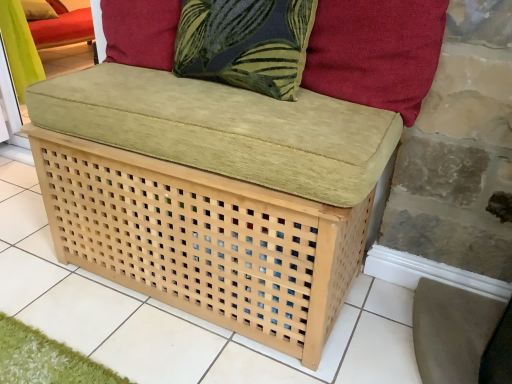
Image resolution: width=512 pixels, height=384 pixels. What do you see at coordinates (245, 43) in the screenshot?
I see `dark blue fabric pillow at upper center` at bounding box center [245, 43].

Image resolution: width=512 pixels, height=384 pixels. Identify the location of velvet cushion at upper left, the 2th pillow positioned from the front. (38, 10).

At what (x,y) coordinates should I click in order to perform the action: click on suede-like red cushion at upper right, the 2th pillow viewed from the left. Please return your answer as a coordinate pair (x, y). Image resolution: width=512 pixels, height=384 pixels. Looking at the image, I should click on (376, 52).

Who is taller, dark blue fabric pillow at upper center or velvet cushion at upper left, acting as the 1th pillow starting from the top?

Standing taller between the two is dark blue fabric pillow at upper center.

Based on the photo, in terms of width, does dark blue fabric pillow at upper center look wider or thinner when compared to velvet cushion at upper left, the second pillow when ordered from bottom to top?

Clearly, dark blue fabric pillow at upper center has less width compared to velvet cushion at upper left, the second pillow when ordered from bottom to top.

Is dark blue fabric pillow at upper center in contact with velvet cushion at upper left, the 2th pillow positioned from the front?

No, dark blue fabric pillow at upper center is not touching velvet cushion at upper left, the 2th pillow positioned from the front.

Is dark blue fabric pillow at upper center smaller than velvet cushion at upper left, which appears as the second pillow when viewed from the right?

Incorrect, dark blue fabric pillow at upper center is not smaller in size than velvet cushion at upper left, which appears as the second pillow when viewed from the right.

Considering the sizes of objects dark blue fabric pillow at upper center and suede-like red cushion at upper right, the 1th pillow viewed from the right, in the image provided, who is smaller, dark blue fabric pillow at upper center or suede-like red cushion at upper right, the 1th pillow viewed from the right,?

suede-like red cushion at upper right, the 1th pillow viewed from the right.

Could you measure the distance between dark blue fabric pillow at upper center and suede-like red cushion at upper right, marked as the 2th pillow in a top-to-bottom arrangement?

dark blue fabric pillow at upper center and suede-like red cushion at upper right, marked as the 2th pillow in a top-to-bottom arrangement, are 7.28 inches apart from each other.

From a real-world perspective, is dark blue fabric pillow at upper center beneath suede-like red cushion at upper right, which appears as the first pillow when ordered from the bottom?

Yes, from a real-world perspective, dark blue fabric pillow at upper center is below suede-like red cushion at upper right, which appears as the first pillow when ordered from the bottom.

Which object is closer to the camera taking this photo, dark blue fabric pillow at upper center or suede-like red cushion at upper right, marked as the 2th pillow in a top-to-bottom arrangement?

suede-like red cushion at upper right, marked as the 2th pillow in a top-to-bottom arrangement, is closer to the camera.

The height and width of the screenshot is (384, 512). Find the location of `pillow that appears on the right of velvet cushion at upper left, acting as the 1th pillow starting from the top`. pillow that appears on the right of velvet cushion at upper left, acting as the 1th pillow starting from the top is located at coordinates (376, 52).

Looking at the image, does velvet cushion at upper left, which ranks as the 1th pillow in left-to-right order, seem bigger or smaller compared to suede-like red cushion at upper right, which appears as the first pillow when ordered from the bottom?

Considering their sizes, velvet cushion at upper left, which ranks as the 1th pillow in left-to-right order, takes up less space than suede-like red cushion at upper right, which appears as the first pillow when ordered from the bottom.

Is velvet cushion at upper left, acting as the 1th pillow starting from the top, to the left or to the right of suede-like red cushion at upper right, which appears as the first pillow when ordered from the bottom, in the image?

Clearly, velvet cushion at upper left, acting as the 1th pillow starting from the top, is on the left of suede-like red cushion at upper right, which appears as the first pillow when ordered from the bottom, in the image.

From a real-world perspective, between velvet cushion at upper left, which ranks as the 1th pillow in left-to-right order, and suede-like red cushion at upper right, the 2th pillow viewed from the left, who is vertically higher?

suede-like red cushion at upper right, the 2th pillow viewed from the left, from a real-world perspective.

From the image's perspective, does suede-like red cushion at upper right, which appears as the first pillow when ordered from the bottom, appear lower than velvet cushion at upper left, which appears as the second pillow when viewed from the right?

Yes.

Between suede-like red cushion at upper right, positioned as the first pillow in front-to-back order, and velvet cushion at upper left, acting as the 1th pillow starting from the top, which one has less height?

velvet cushion at upper left, acting as the 1th pillow starting from the top, is shorter.

Is suede-like red cushion at upper right, which appears as the second pillow when viewed from the back, turned away from dark blue fabric pillow at upper center?

No, suede-like red cushion at upper right, which appears as the second pillow when viewed from the back, is not facing the opposite direction of dark blue fabric pillow at upper center.

Considering the sizes of objects suede-like red cushion at upper right, the 2th pillow viewed from the left, and dark blue fabric pillow at upper center in the image provided, who is smaller, suede-like red cushion at upper right, the 2th pillow viewed from the left, or dark blue fabric pillow at upper center?

Smaller between the two is suede-like red cushion at upper right, the 2th pillow viewed from the left.

Would you consider suede-like red cushion at upper right, the 2th pillow viewed from the left, to be distant from dark blue fabric pillow at upper center?

They are positioned close to each other.

Measure the distance between suede-like red cushion at upper right, marked as the 2th pillow in a top-to-bottom arrangement, and dark blue fabric pillow at upper center.

suede-like red cushion at upper right, marked as the 2th pillow in a top-to-bottom arrangement, is 7.28 inches away from dark blue fabric pillow at upper center.

Measure the distance between velvet cushion at upper left, the first pillow in the back-to-front sequence, and dark blue fabric pillow at upper center.

They are 8.95 feet apart.

From a real-world perspective, is velvet cushion at upper left, acting as the 1th pillow starting from the top, over dark blue fabric pillow at upper center?

Actually, velvet cushion at upper left, acting as the 1th pillow starting from the top, is physically below dark blue fabric pillow at upper center in the real world.

Looking at the image, does velvet cushion at upper left, which ranks as the 1th pillow in left-to-right order, seem bigger or smaller compared to dark blue fabric pillow at upper center?

Considering their sizes, velvet cushion at upper left, which ranks as the 1th pillow in left-to-right order, takes up less space than dark blue fabric pillow at upper center.

Consider the image. Which object is positioned more to the left, velvet cushion at upper left, the first pillow in the back-to-front sequence, or dark blue fabric pillow at upper center?

velvet cushion at upper left, the first pillow in the back-to-front sequence.

Where is `pillow on the left of dark blue fabric pillow at upper center`? This screenshot has width=512, height=384. pillow on the left of dark blue fabric pillow at upper center is located at coordinates (38, 10).

This screenshot has height=384, width=512. In order to click on throw pillow that is above the suede-like red cushion at upper right, which appears as the second pillow when viewed from the back (from the image's perspective) in this screenshot , I will do (x=245, y=43).

Estimate the real-world distances between objects in this image. Which object is further from velvet cushion at upper left, acting as the 1th pillow starting from the top, dark blue fabric pillow at upper center or suede-like red cushion at upper right, the 1th pillow viewed from the right?

The object further to velvet cushion at upper left, acting as the 1th pillow starting from the top, is suede-like red cushion at upper right, the 1th pillow viewed from the right.

From the image, which object appears to be farther from velvet cushion at upper left, acting as the 1th pillow starting from the top, suede-like red cushion at upper right, the 2th pillow viewed from the left, or dark blue fabric pillow at upper center?

The object further to velvet cushion at upper left, acting as the 1th pillow starting from the top, is suede-like red cushion at upper right, the 2th pillow viewed from the left.

When comparing their distances from suede-like red cushion at upper right, marked as the 2th pillow in a top-to-bottom arrangement, does velvet cushion at upper left, the 2th pillow positioned from the front, or dark blue fabric pillow at upper center seem further?

velvet cushion at upper left, the 2th pillow positioned from the front, is further to suede-like red cushion at upper right, marked as the 2th pillow in a top-to-bottom arrangement.

From the image, which object appears to be nearer to dark blue fabric pillow at upper center, suede-like red cushion at upper right, marked as the 2th pillow in a top-to-bottom arrangement, or velvet cushion at upper left, the second pillow when ordered from bottom to top?

The object closer to dark blue fabric pillow at upper center is suede-like red cushion at upper right, marked as the 2th pillow in a top-to-bottom arrangement.

From the image, which object appears to be nearer to suede-like red cushion at upper right, the 1th pillow viewed from the right, dark blue fabric pillow at upper center or velvet cushion at upper left, acting as the 1th pillow starting from the top?

dark blue fabric pillow at upper center is positioned closer to the anchor suede-like red cushion at upper right, the 1th pillow viewed from the right.

From the image, which object appears to be farther from dark blue fabric pillow at upper center, velvet cushion at upper left, which appears as the second pillow when viewed from the right, or suede-like red cushion at upper right, positioned as the first pillow in front-to-back order?

velvet cushion at upper left, which appears as the second pillow when viewed from the right, lies further to dark blue fabric pillow at upper center than the other object.

The image size is (512, 384). What are the coordinates of `throw pillow positioned between suede-like red cushion at upper right, positioned as the first pillow in front-to-back order, and velvet cushion at upper left, the second pillow when ordered from bottom to top, from near to far` in the screenshot? It's located at (245, 43).